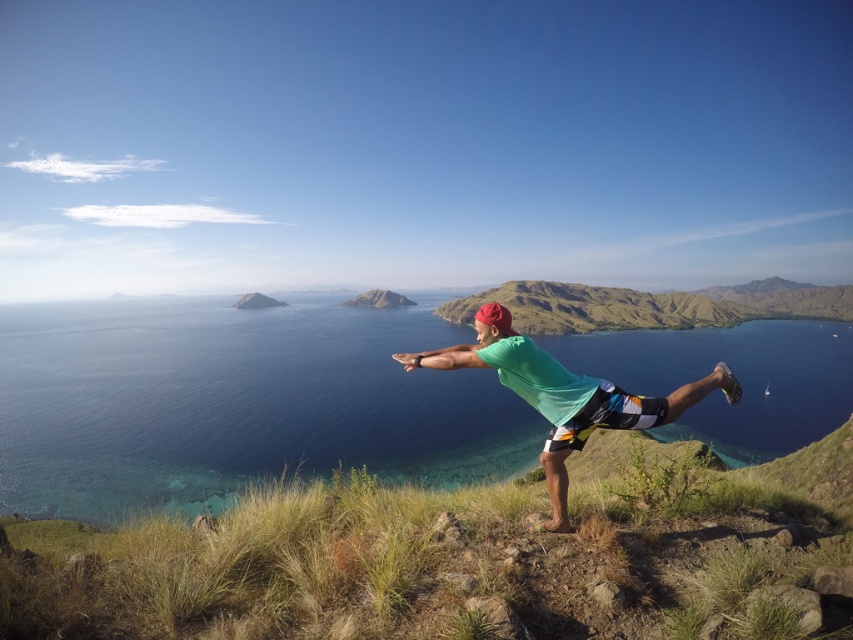
You are standing at point (622, 388) and want to walk to the person on the grassy hillside. Which direction should you move relative to point (561, 426)?

You should move towards point (561, 426) because it is in front of point (622, 388), so walking towards it will bring you closer to the person on the grassy hillside.

You are standing on the grassy hillside and want to look at the clear blue water at center and the green fabric shirt at center. Which object is positioned to the right of the other?

The clear blue water at center is to the right of the green fabric shirt at center.

You are a photographer trying to capture the person in the green fabric shirt at center. However, the clear blue water at center is blocking your view. Can you adjust your position to see the person clearly?

The green fabric shirt at center is behind the clear blue water at center, so you can adjust your position to move around the water to see the person clearly.